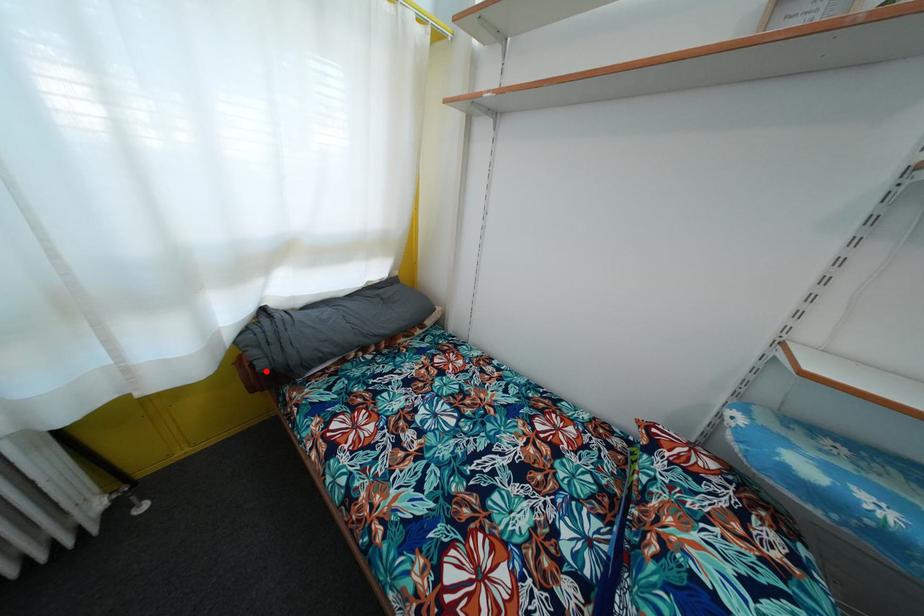
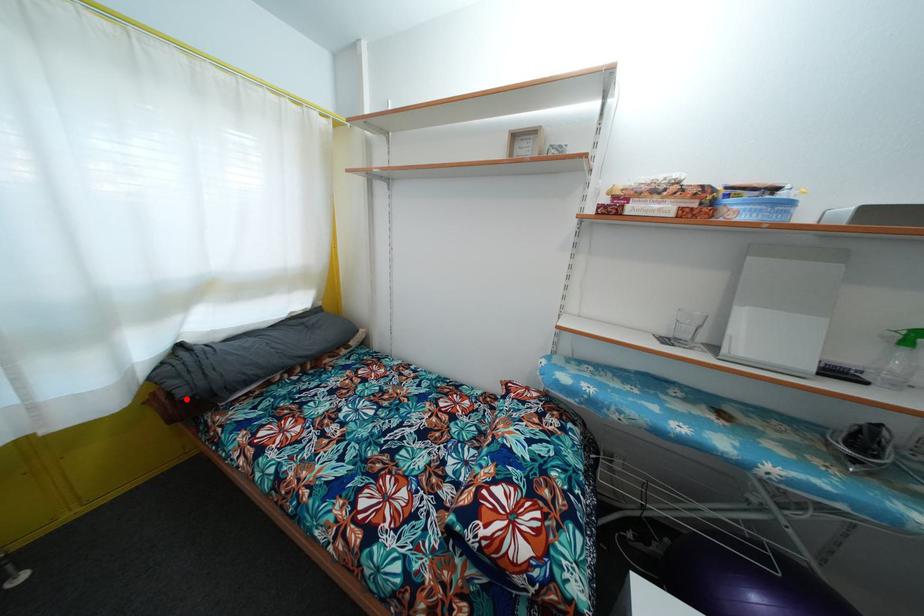
I am providing you with two images of the same scene from different viewpoints. A red point is marked on the first image and another point is marked on the second image. Does the point marked in image1 correspond to the same location as the one in image2?

Yes